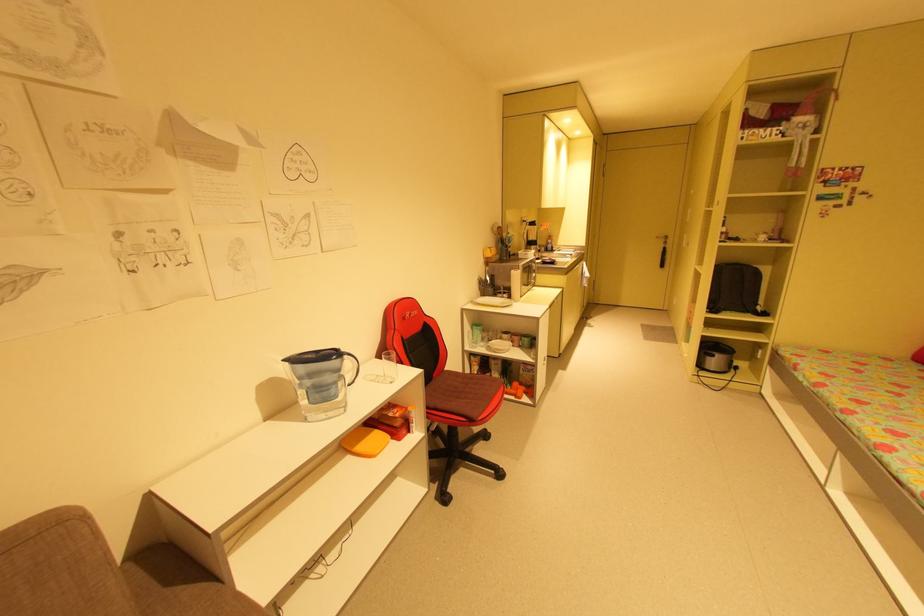
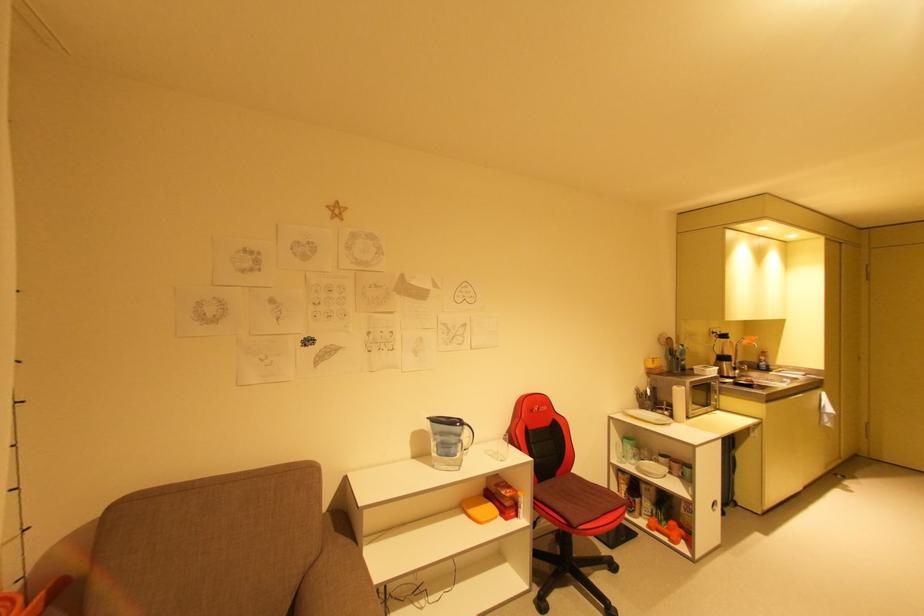
In the second image, find the point that corresponds to point (521, 395) in the first image.

(675, 538)